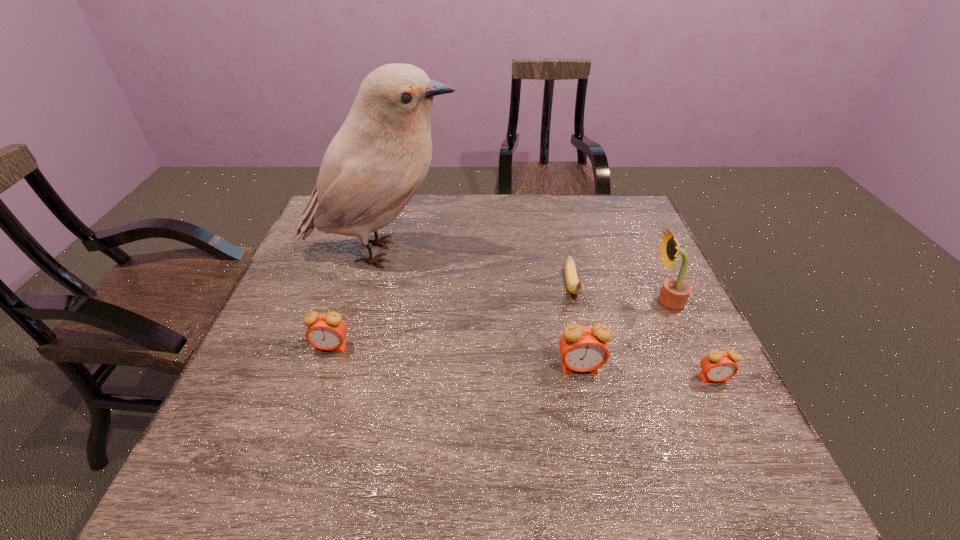
This screenshot has height=540, width=960. I want to click on vacant area situated on the face of the second alarm clock from left to right, so click(x=588, y=404).

I want to click on free point located on the face of the rightmost alarm clock, so click(728, 409).

The image size is (960, 540). I want to click on vacant space located at the stem of the shortest object, so click(x=592, y=373).

Identify the location of blank space located 0.120m on the face of the tallest object. The width and height of the screenshot is (960, 540). point(502,253).

Identify the location of blank area located on the face of the fifth shortest object. (489, 303).

In order to click on vacant space located on the face of the fifth shortest object in this screenshot , I will do `click(509, 303)`.

You are a GUI agent. You are given a task and a screenshot of the screen. Output one action in this format:
    pyautogui.click(x=<x>, y=<y>)
    Task: Click on the vacant space located on the face of the fifth shortest object
    
    Given the screenshot: What is the action you would take?
    pyautogui.click(x=516, y=303)

Identify the location of object situated at the far edge. (376, 162).

You are a GUI agent. You are given a task and a screenshot of the screen. Output one action in this format:
    pyautogui.click(x=<x>, y=<y>)
    Task: Click on the alarm clock situated at the left edge
    This screenshot has height=540, width=960.
    Given the screenshot: What is the action you would take?
    pyautogui.click(x=327, y=331)

Locate an element on the screen. The width and height of the screenshot is (960, 540). parakeet positioned at the left edge is located at coordinates (376, 162).